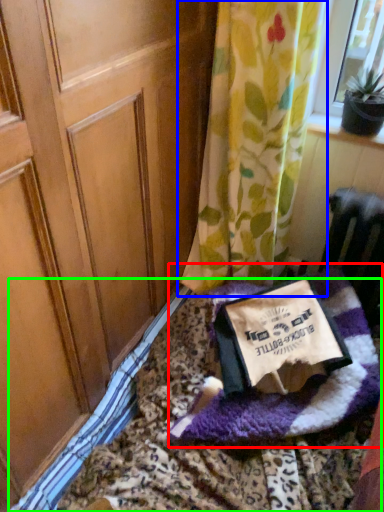
Question: Based on their relative distances, which object is farther from blanket (highlighted by a red box)? Choose from curtain (highlighted by a blue box) and bedding (highlighted by a green box).

Choices:
 (A) curtain
 (B) bedding

Answer: (A)